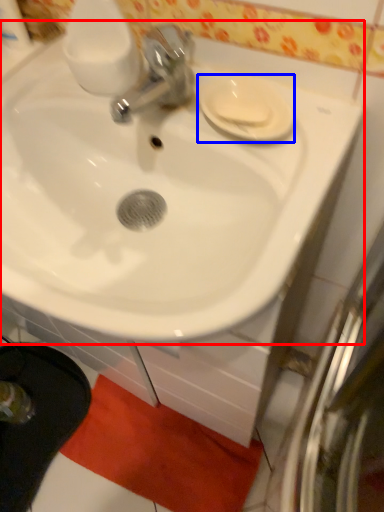
Question: Which object is closer to the camera taking this photo, sink (highlighted by a red box) or saucer (highlighted by a blue box)?

Choices:
 (A) sink
 (B) saucer

Answer: (A)